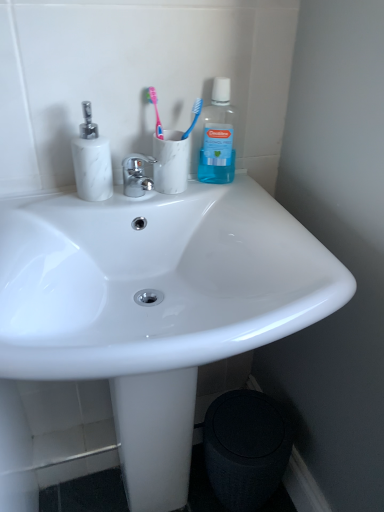
Question: From a real-world perspective, is white glossy sink at center positioned above or below white marble soap dispenser at left?

Choices:
 (A) below
 (B) above

Answer: (A)

Question: From the image's perspective, is white glossy sink at center located above or below white marble soap dispenser at left?

Choices:
 (A) above
 (B) below

Answer: (B)

Question: Which of these objects is positioned farthest from the chrome/metallic faucet at center?

Choices:
 (A) white marble soap dispenser at left
 (B) black textured trash bin/can at lower right
 (C) white marble toothbrush holder at upper center
 (D) white glossy sink at center
 (E) blue translucent toothbrush at upper center, the 1th toothbrush from the right

Answer: (B)

Question: Considering the real-world distances, which object is farthest from the transparent plastic mouthwash at upper right?

Choices:
 (A) black textured trash bin/can at lower right
 (B) white marble soap dispenser at left
 (C) white marble toothbrush holder at upper center
 (D) white glossy sink at center
 (E) pink plastic toothbrush at upper center, the 2th toothbrush viewed from the right

Answer: (A)